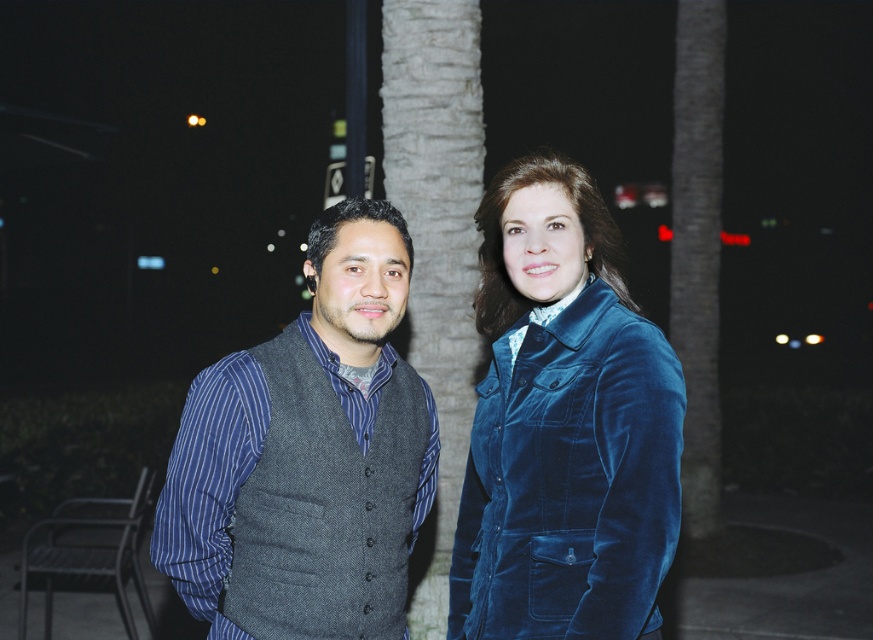
Question: Does velvet blue jacket at center appear over velvet blue jacket at right?

Choices:
 (A) no
 (B) yes

Answer: (B)

Question: Which is nearer to the velvet blue jacket at right?

Choices:
 (A) gray wool vest at left
 (B) velvet blue jacket at center

Answer: (B)

Question: Among these points, which one is nearest to the camera?

Choices:
 (A) (352, 497)
 (B) (492, 458)

Answer: (B)

Question: Which point is farther to the camera?

Choices:
 (A) gray wool vest at left
 (B) velvet blue jacket at center

Answer: (A)

Question: Can you confirm if velvet blue jacket at center is positioned to the left of velvet blue jacket at right?

Choices:
 (A) yes
 (B) no

Answer: (A)

Question: Can you confirm if velvet blue jacket at right is wider than gray wool vest at left?

Choices:
 (A) no
 (B) yes

Answer: (A)